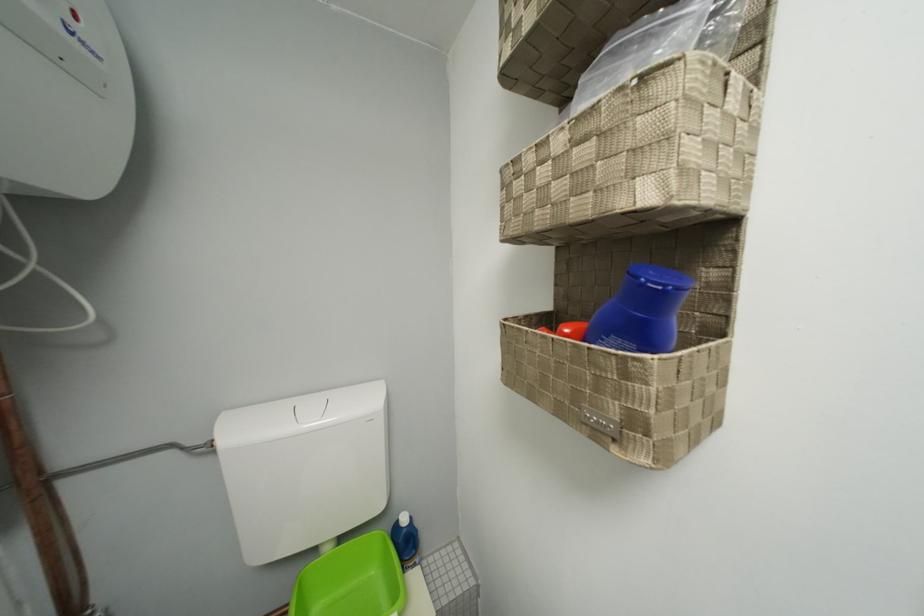
Find the location of a particular element. The image size is (924, 616). toilet flush button is located at coordinates (310, 410).